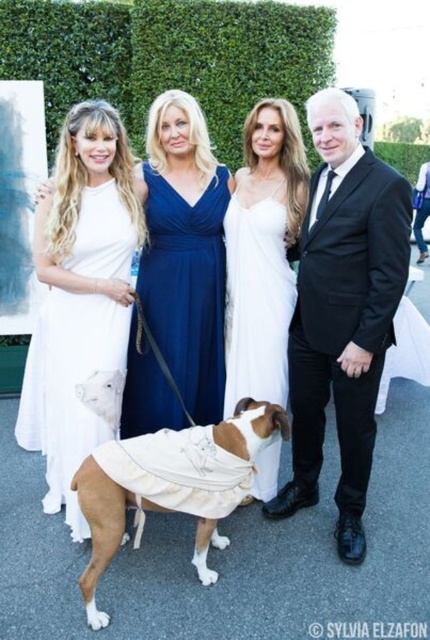
Based on the scene description, which object is located at the coordinates point (263,252)?

The object at point (263,252) is the white satin dress at center.

You are a photographer at an event and need to arrange two dresses, the blue satin dress at center and the white satin dress at center, for a photo shoot. Which dress should you choose if you want the one that takes up more visual space in the frame?

The blue satin dress at center has a larger size compared to the white satin dress at center, so it would take up more visual space in the frame.